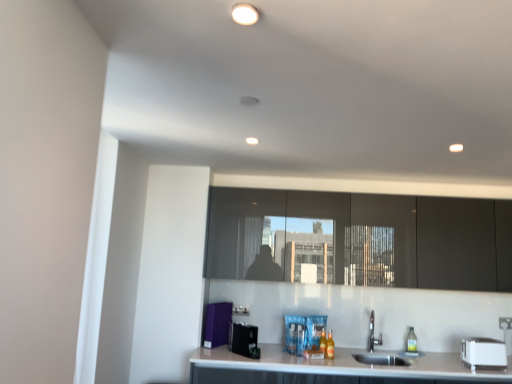
The width and height of the screenshot is (512, 384). I want to click on unoccupied region to the right of white glossy light fixture at upper center, so click(296, 13).